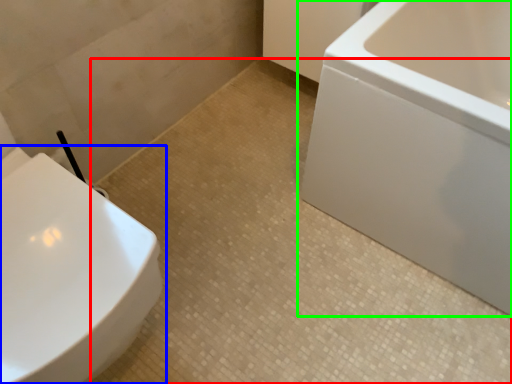
Question: Which object is the closest to the ceramic tile (highlighted by a red box)? Choose among these: toilet (highlighted by a blue box) or bathtub (highlighted by a green box).

Choices:
 (A) toilet
 (B) bathtub

Answer: (B)